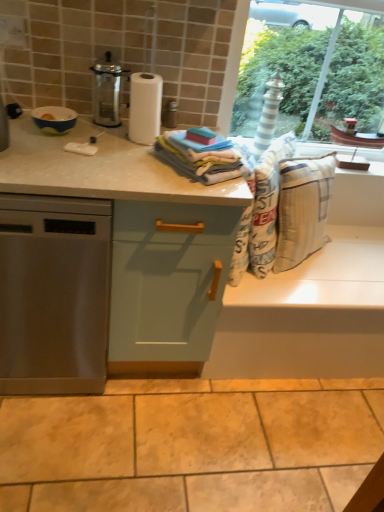
Locate an element on the screen. free space in front of soft cotton towels at center is located at coordinates tap(179, 186).